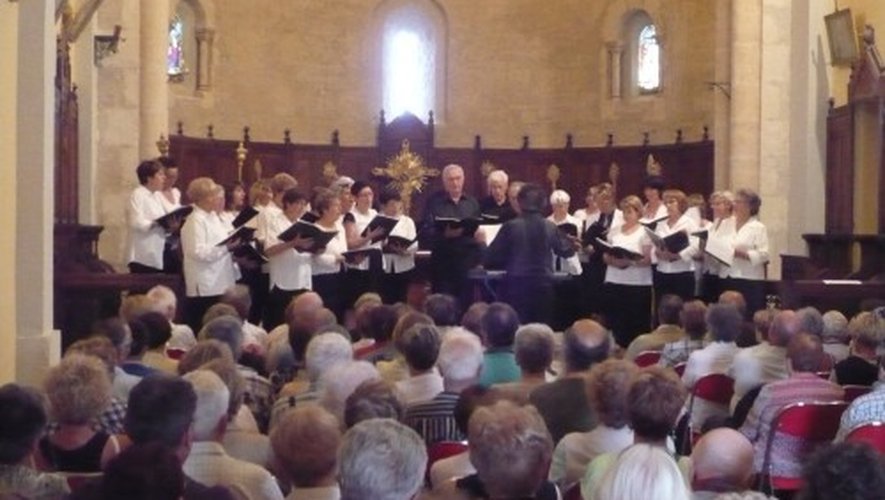
This screenshot has height=500, width=885. I want to click on stained glass window, so click(174, 42).